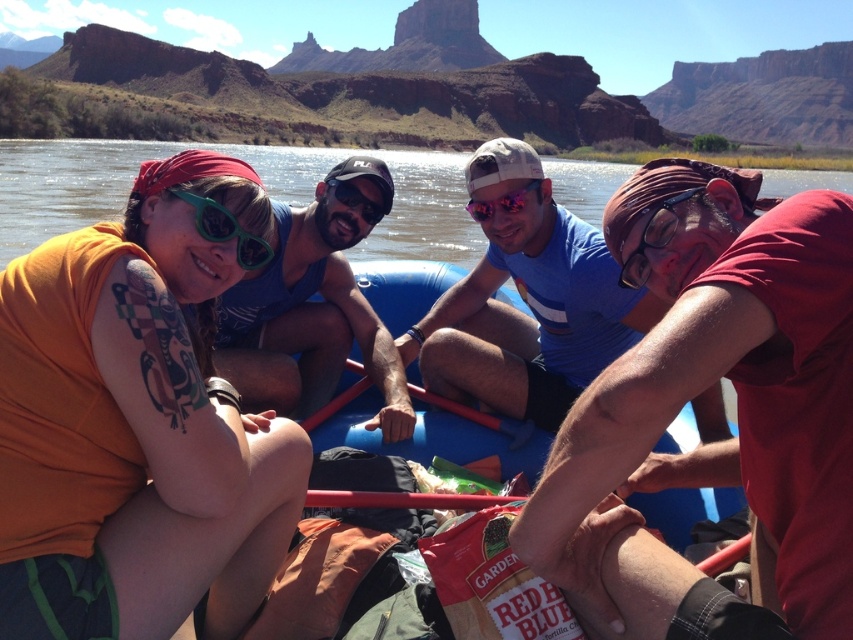
Can you confirm if transparent plastic goggles at center is taller than pink reflective goggles at center?

Yes, transparent plastic goggles at center is taller than pink reflective goggles at center.

Is point (637, 280) closer to viewer compared to point (492, 198)?

Yes, point (637, 280) is closer to viewer.

Where is `transparent plastic goggles at center`? This screenshot has width=853, height=640. transparent plastic goggles at center is located at coordinates (653, 237).

Can you confirm if orange fabric at center is shorter than matte black goggles at center?

Indeed, orange fabric at center has a lesser height compared to matte black goggles at center.

Does orange fabric at center have a larger size compared to matte black goggles at center?

Actually, orange fabric at center might be smaller than matte black goggles at center.

Is point (152, 355) farther from camera compared to point (376, 218)?

That is False.

Identify the location of orange fabric at center. The image size is (853, 640). (138, 419).

Image resolution: width=853 pixels, height=640 pixels. Describe the element at coordinates (225, 228) in the screenshot. I see `green plastic goggles at upper left` at that location.

Can you confirm if green plastic goggles at upper left is positioned below transparent plastic goggles at center?

Actually, green plastic goggles at upper left is above transparent plastic goggles at center.

Does point (206, 221) lie behind point (682, 196)?

No, it is not.

In order to click on green plastic goggles at upper left in this screenshot , I will do `click(225, 228)`.